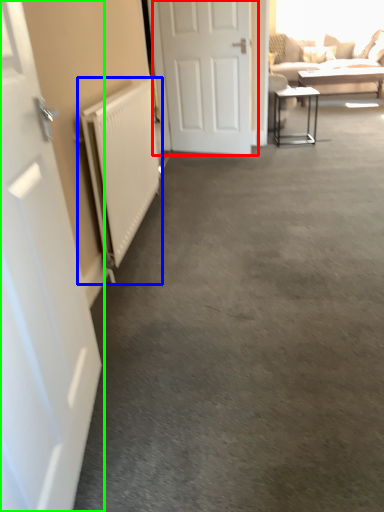
Question: Which object is the farthest from door (highlighted by a red box)? Choose among these: radiator (highlighted by a blue box) or door (highlighted by a green box).

Choices:
 (A) radiator
 (B) door

Answer: (B)